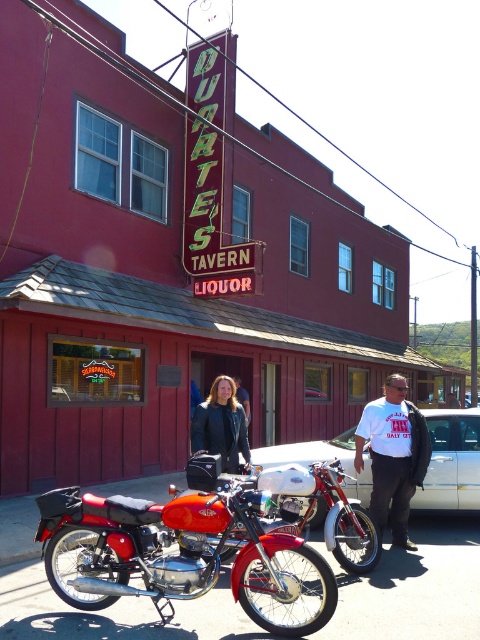
The image size is (480, 640). What do you see at coordinates (181, 554) in the screenshot?
I see `shiny red motorcycle at center` at bounding box center [181, 554].

Between shiny red motorcycle at center and white cotton t-shirt at center, which one is positioned higher?

white cotton t-shirt at center

Which is in front, point (171, 563) or point (374, 488)?

Point (171, 563)

In order to click on shiny red motorcycle at center in this screenshot , I will do `click(181, 554)`.

Consider the image. Is shiny red motorcycle at center shorter than silver metallic car at center?

Incorrect, shiny red motorcycle at center's height does not fall short of silver metallic car at center's.

This screenshot has height=640, width=480. Describe the element at coordinates (181, 554) in the screenshot. I see `shiny red motorcycle at center` at that location.

Where is `shiny red motorcycle at center`? This screenshot has width=480, height=640. shiny red motorcycle at center is located at coordinates (181, 554).

Who is positioned more to the right, silver metallic car at center or white cotton t-shirt at center?

white cotton t-shirt at center is more to the right.

Who is more distant from viewer, (294,460) or (404,449)?

Point (294,460)

Where is `silver metallic car at center`? silver metallic car at center is located at coordinates [x=451, y=461].